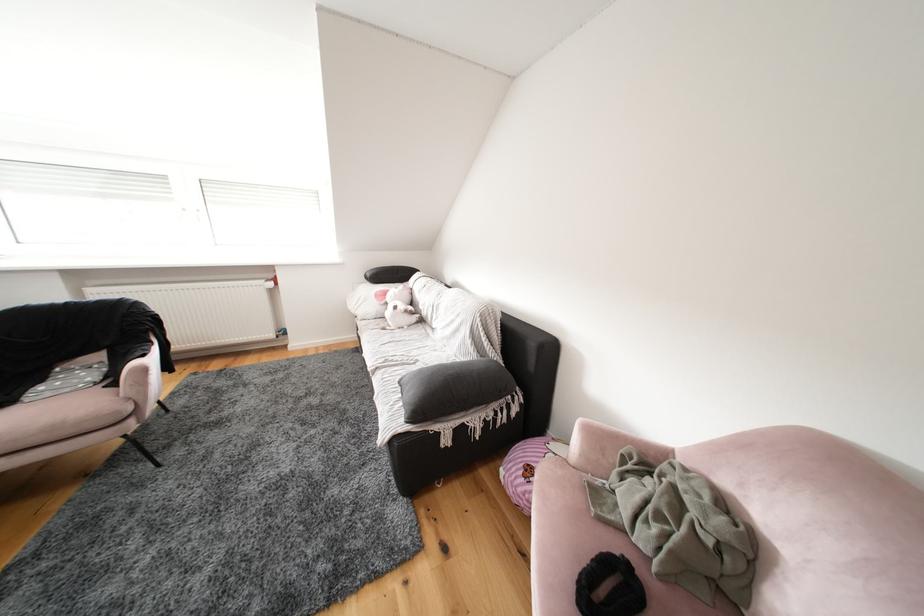
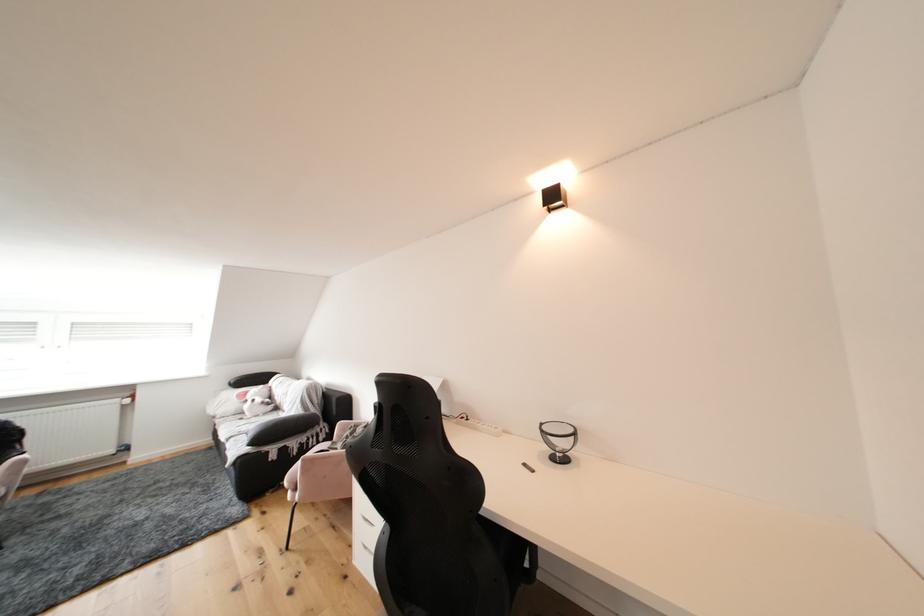
Find the pixel in the second image that matches (x=504, y=424) in the first image.

(317, 447)